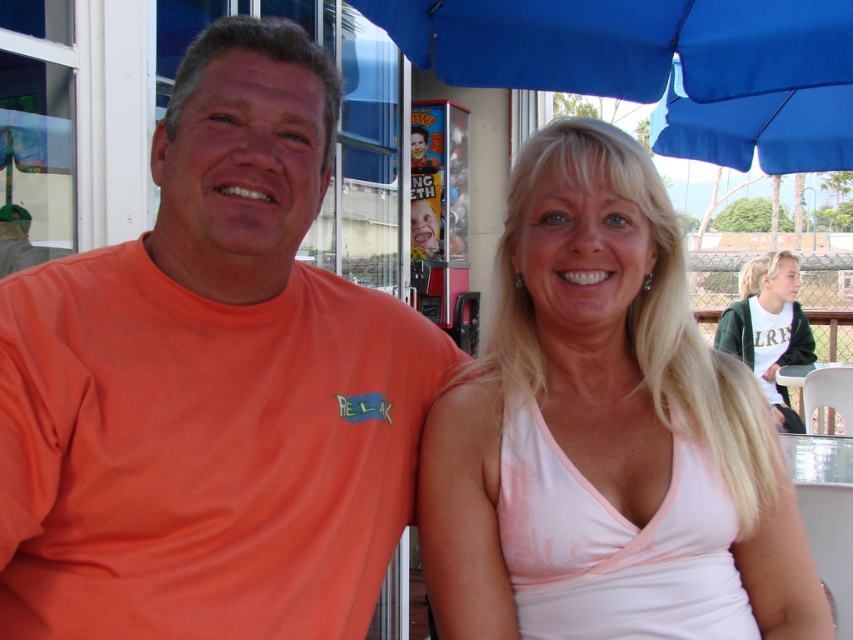
Looking at this image, which is above, pink satin tank top at upper right or white cotton shirt at upper right?

Positioned higher is white cotton shirt at upper right.

Does pink satin tank top at upper right appear on the right side of white cotton shirt at upper right?

In fact, pink satin tank top at upper right is to the left of white cotton shirt at upper right.

Where is `pink satin tank top at upper right`? Image resolution: width=853 pixels, height=640 pixels. pink satin tank top at upper right is located at coordinates (602, 424).

Is pink satin tank top at upper right to the right of blue fabric umbrella at upper center from the viewer's perspective?

In fact, pink satin tank top at upper right is to the left of blue fabric umbrella at upper center.

Is the position of pink satin tank top at upper right more distant than that of blue fabric umbrella at upper center?

No.

Locate an element on the screen. Image resolution: width=853 pixels, height=640 pixels. pink satin tank top at upper right is located at coordinates (602, 424).

You are a GUI agent. You are given a task and a screenshot of the screen. Output one action in this format:
    pyautogui.click(x=<x>, y=<y>)
    Task: Click on the pink satin tank top at upper right
    
    Given the screenshot: What is the action you would take?
    pyautogui.click(x=602, y=424)

Based on the photo, who is more forward, (286, 532) or (709, 141)?

Point (286, 532) is in front.

Can you confirm if orange t-shirt at left is thinner than blue fabric umbrella at upper center?

Yes, orange t-shirt at left is thinner than blue fabric umbrella at upper center.

Is point (180, 614) positioned before point (766, 33)?

Yes, it is.

I want to click on orange t-shirt at left, so click(212, 385).